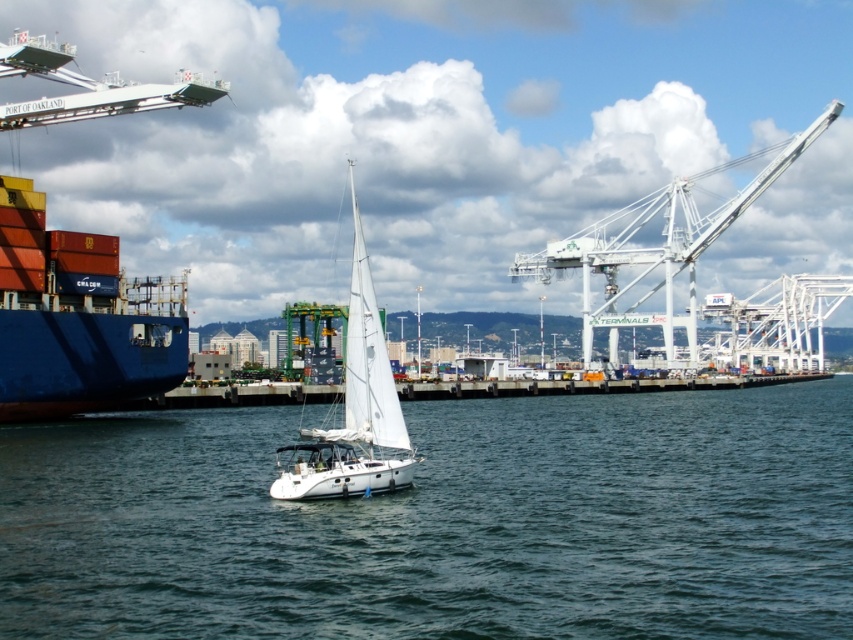
Question: Is clear blue water at center closer to the viewer compared to white metallic crane at upper right?

Choices:
 (A) no
 (B) yes

Answer: (B)

Question: Which object is positioned closest to the white matte sailboat at center?

Choices:
 (A) white metallic crane at upper right
 (B) clear blue water at center

Answer: (B)

Question: Among these points, which one is farthest from the camera?

Choices:
 (A) (67, 628)
 (B) (370, 371)

Answer: (B)

Question: Is white metallic crane at upper right to the right of white matte sailboat at center from the viewer's perspective?

Choices:
 (A) yes
 (B) no

Answer: (A)

Question: Which object is positioned farthest from the white metallic crane at upper right?

Choices:
 (A) white matte sailboat at center
 (B) clear blue water at center

Answer: (A)

Question: Is white metallic crane at upper right to the right of white matte sailboat at center from the viewer's perspective?

Choices:
 (A) no
 (B) yes

Answer: (B)